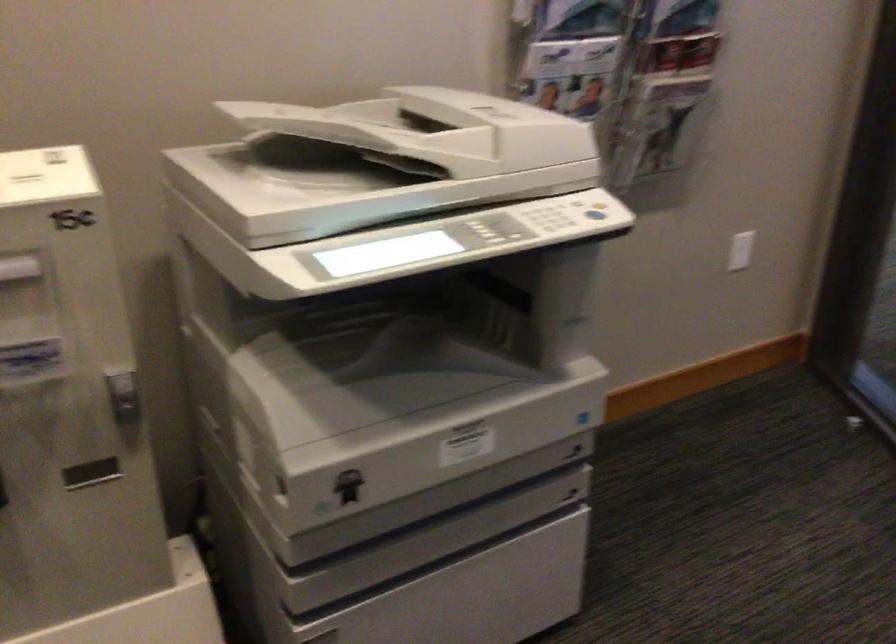
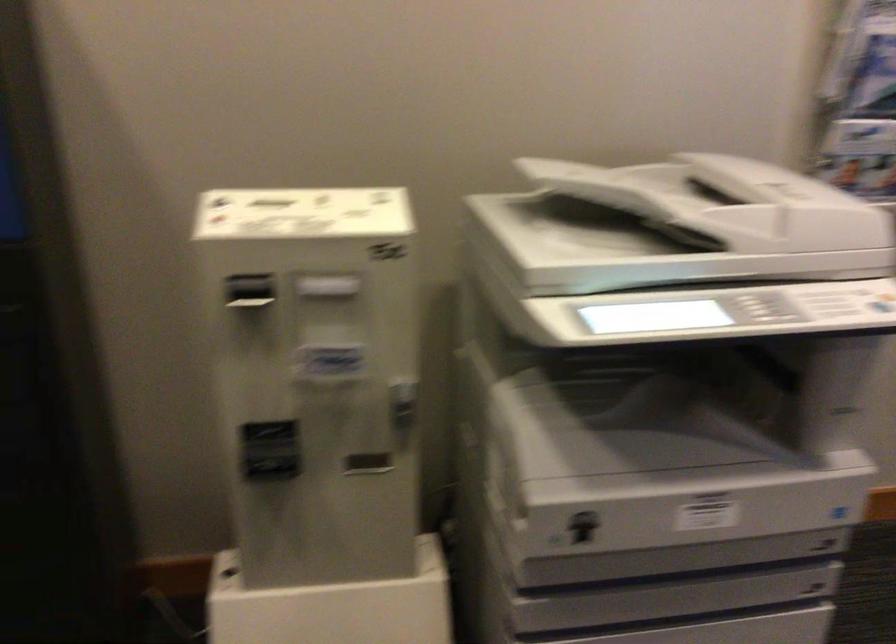
Find the pixel in the second image that matches (x=352, y=484) in the first image.

(582, 526)